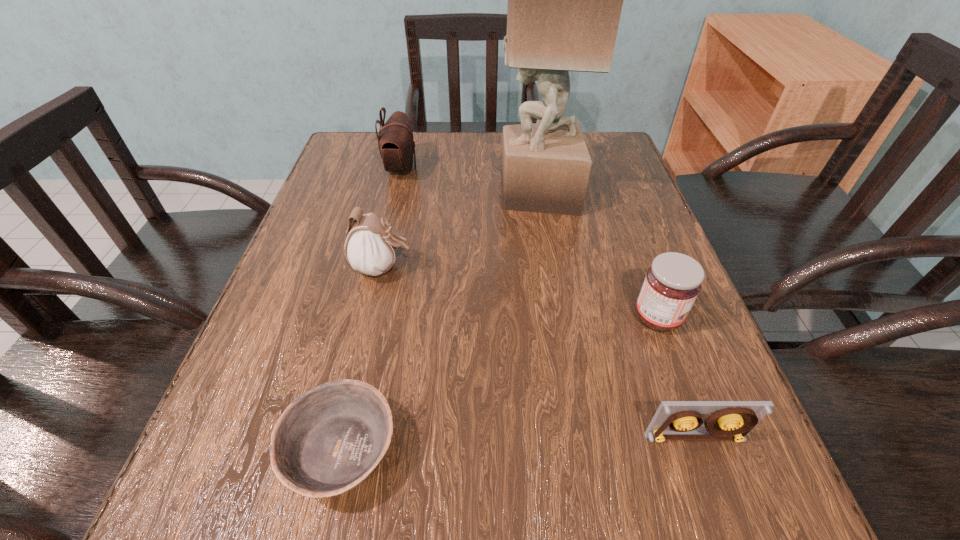
The width and height of the screenshot is (960, 540). What are the coordinates of `vacant space at the near right corner` in the screenshot? It's located at (705, 505).

At what (x,y) coordinates should I click in order to perform the action: click on empty location between the tallest object and the videotape. Please return your answer as a coordinate pair (x, y). The image size is (960, 540). Looking at the image, I should click on (616, 315).

Where is `empty space that is in between the fourth nearest object and the bowl`? empty space that is in between the fourth nearest object and the bowl is located at coordinates (362, 360).

The image size is (960, 540). Find the location of `vacant space that is in between the videotape and the third nearest object`. vacant space that is in between the videotape and the third nearest object is located at coordinates (677, 377).

Find the location of a particular element. Image resolution: width=960 pixels, height=540 pixels. empty location between the third farthest object and the third nearest object is located at coordinates (520, 293).

Locate an element on the screen. This screenshot has width=960, height=540. free space between the sculpture and the fourth farthest object is located at coordinates (597, 255).

Image resolution: width=960 pixels, height=540 pixels. In order to click on vacant region between the jam and the farther pouch in this screenshot , I will do `click(530, 243)`.

Find the location of a particular element. blank region between the third farthest object and the third nearest object is located at coordinates (520, 293).

Identify the location of free space between the farther pouch and the jam. The height and width of the screenshot is (540, 960). (530, 243).

You are a GUI agent. You are given a task and a screenshot of the screen. Output one action in this format:
    pyautogui.click(x=<x>, y=<y>)
    Task: Click on the free space between the farther pouch and the shortest object
    The width and height of the screenshot is (960, 540).
    Given the screenshot: What is the action you would take?
    pyautogui.click(x=372, y=310)